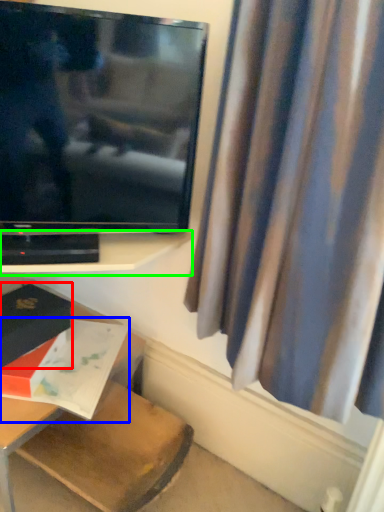
Question: Which object is positioned closest to book (highlighted by a red box)? Select from book (highlighted by a blue box) and shelf (highlighted by a green box).

Choices:
 (A) book
 (B) shelf

Answer: (A)